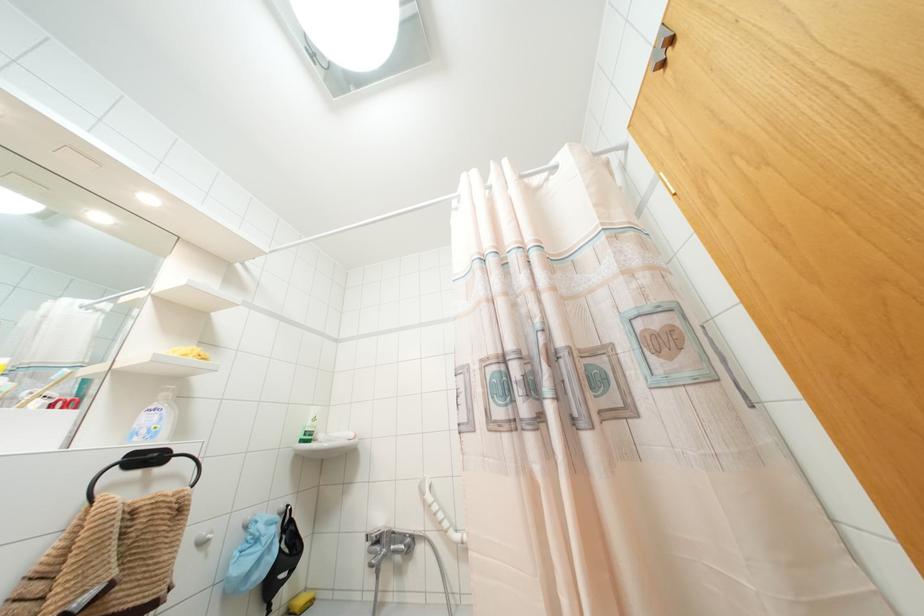
The location [300,602] corresponds to which object?

This point indicates the yellow sponge.